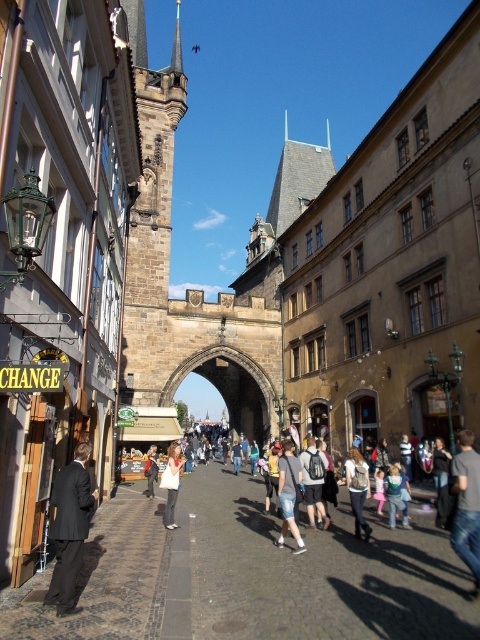
Between jeans at lower right and light gray jeans at center, which one has less height?

With less height is light gray jeans at center.

Does jeans at lower right appear on the left side of light gray jeans at center?

No, jeans at lower right is not to the left of light gray jeans at center.

Describe the element at coordinates (467, 506) in the screenshot. I see `jeans at lower right` at that location.

Locate an element on the screen. jeans at lower right is located at coordinates (467, 506).

Measure the distance between point (66, 483) and camera.

They are 38.84 meters apart.

Which is above, black suit at left or denim jacket at center?

Positioned higher is black suit at left.

Is point (78, 499) positioned after point (359, 461)?

No.

You are a GUI agent. You are given a task and a screenshot of the screen. Output one action in this format:
    pyautogui.click(x=<x>, y=<y>)
    Task: Click on the black suit at left
    
    Given the screenshot: What is the action you would take?
    pyautogui.click(x=70, y=529)

Which is more to the right, jeans at lower right or white cotton shirt at center?

jeans at lower right

Is point (460, 529) positioned in front of point (151, 448)?

Yes, it is.

This screenshot has height=640, width=480. What do you see at coordinates (467, 506) in the screenshot?
I see `jeans at lower right` at bounding box center [467, 506].

Locate an element on the screen. This screenshot has width=480, height=640. jeans at lower right is located at coordinates tap(467, 506).